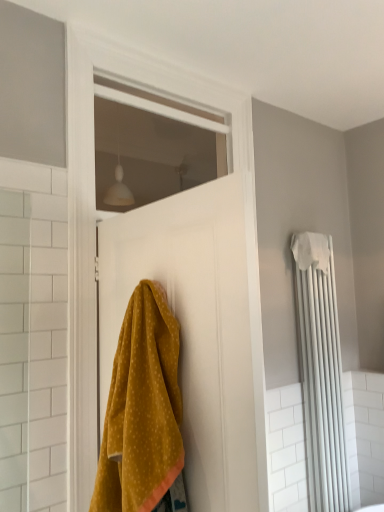
Question: In the image, is white fabric bath towel at right positioned in front of or behind mustard yellow fabric at center?

Choices:
 (A) front
 (B) behind

Answer: (B)

Question: From the image's perspective, is white fabric bath towel at right above or below mustard yellow fabric at center?

Choices:
 (A) below
 (B) above

Answer: (B)

Question: Which object is positioned farthest from the white glass window at upper center?

Choices:
 (A) white fabric bath towel at right
 (B) mustard yellow fabric at center
 (C) white matte door at center
 (D) white matte radiator at right

Answer: (B)

Question: Based on their relative distances, which object is farther from the white glass window at upper center?

Choices:
 (A) mustard yellow fabric at center
 (B) white matte radiator at right
 (C) white fabric bath towel at right
 (D) white matte door at center

Answer: (A)